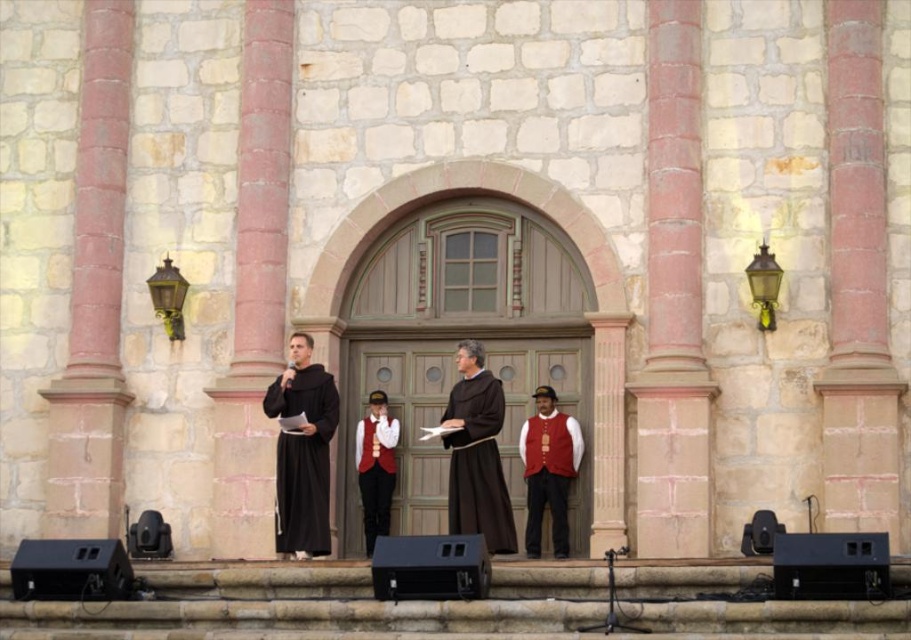
Question: Among these objects, which one is nearest to the camera?

Choices:
 (A) black matte robe at center
 (B) matte red vest at center
 (C) matte black robe at center

Answer: (C)

Question: Which object is the closest to the matte black robe at center?

Choices:
 (A) matte red vest at center
 (B) velvet red vest at center
 (C) black matte robe at center

Answer: (C)

Question: Does matte black robe at center appear over velvet red vest at center?

Choices:
 (A) yes
 (B) no

Answer: (A)

Question: Can you confirm if matte red vest at center is positioned to the left of velvet red vest at center?

Choices:
 (A) yes
 (B) no

Answer: (B)

Question: Estimate the real-world distances between objects in this image. Which object is closer to the matte black robe at center?

Choices:
 (A) velvet red vest at center
 (B) matte red vest at center

Answer: (B)

Question: Does black matte robe at center have a smaller size compared to matte red vest at center?

Choices:
 (A) yes
 (B) no

Answer: (B)